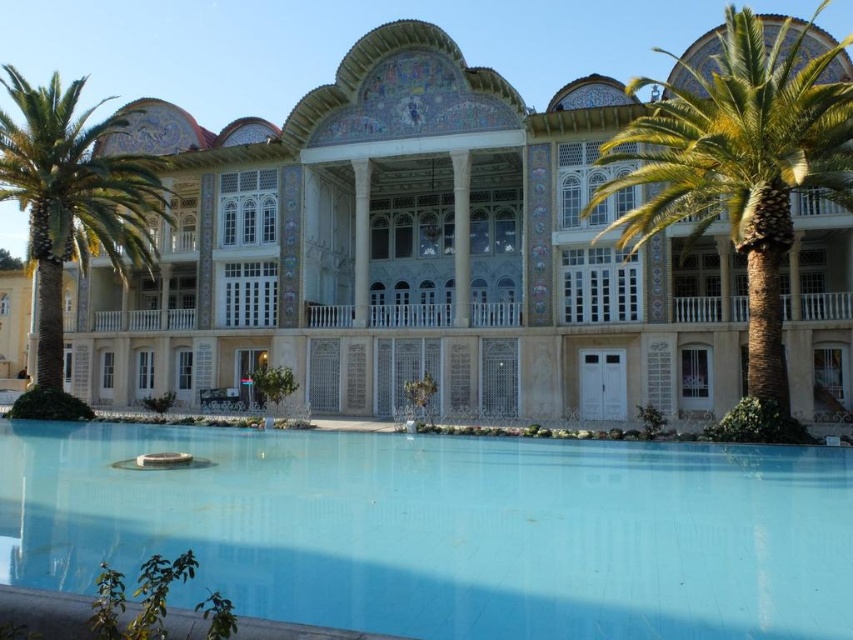
You are standing in front of the beige stone building at center. What are the coordinates of the building in the image?

The beige stone building at center is located at coordinates point (410, 253).

You are standing at the point closest to the building in the image. Which of the two points, point [705,259] or point [80,200], is farther away from you?

Point [705,259] is farther away from you because it is behind point [80,200], which is closer to the building.